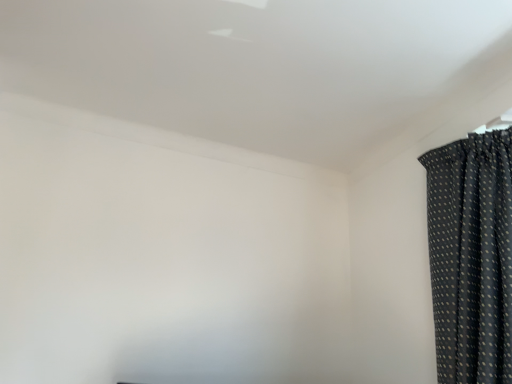
What is the approximate height of black dotted fabric at upper right?

black dotted fabric at upper right is 39.27 inches tall.

The width and height of the screenshot is (512, 384). What do you see at coordinates (471, 256) in the screenshot? I see `black dotted fabric at upper right` at bounding box center [471, 256].

I want to click on black dotted fabric at upper right, so click(471, 256).

The width and height of the screenshot is (512, 384). I want to click on black dotted fabric at upper right, so click(471, 256).